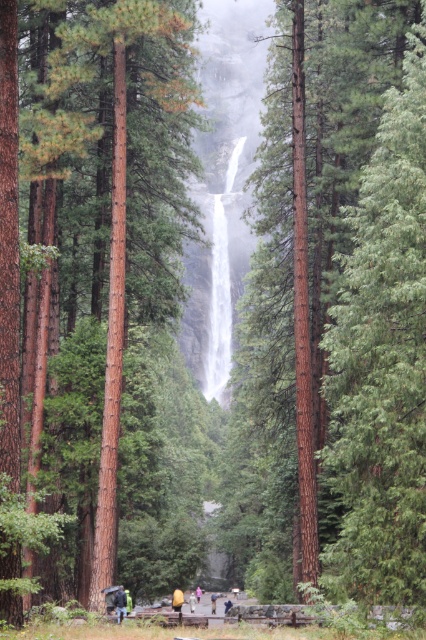
You are a hiker standing at the base of the waterfall and want to identify the trees in front of you. Which tree at center has a smaller size between the green rough bark tree at center and the smooth brown tree trunk at center?

The green rough bark tree at center is smaller than the smooth brown tree trunk at center.

Looking at this image, you are standing at the base of the waterfall in the serene natural scene. There are two points marked in the image, point (29, 13) and point (118, 609). If you want to reach the point that is closer to you, which one should you go to?

Point (118, 609) is closer to you because it is less further than point (29, 13).